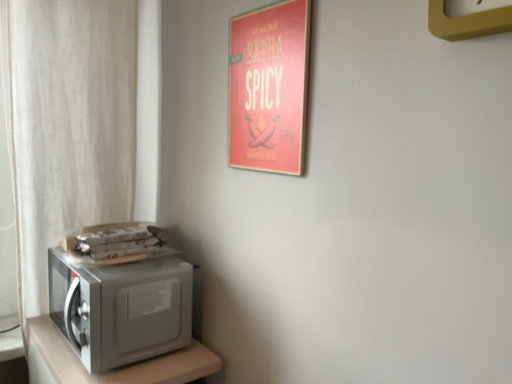
Question: Could you tell me if satin silver microwave at lower left is turned towards yellow plastic clock at upper right?

Choices:
 (A) yes
 (B) no

Answer: (B)

Question: From a real-world perspective, is satin silver microwave at lower left on top of yellow plastic clock at upper right?

Choices:
 (A) yes
 (B) no

Answer: (B)

Question: Can you confirm if satin silver microwave at lower left is positioned to the right of yellow plastic clock at upper right?

Choices:
 (A) no
 (B) yes

Answer: (A)

Question: Considering the relative sizes of satin silver microwave at lower left and yellow plastic clock at upper right in the image provided, is satin silver microwave at lower left wider than yellow plastic clock at upper right?

Choices:
 (A) no
 (B) yes

Answer: (B)

Question: From the image's perspective, is satin silver microwave at lower left beneath yellow plastic clock at upper right?

Choices:
 (A) no
 (B) yes

Answer: (B)

Question: Do you think satin silver microwave at lower left is within white sheer curtain at left, or outside of it?

Choices:
 (A) inside
 (B) outside

Answer: (B)

Question: Considering the positions of satin silver microwave at lower left and white sheer curtain at left in the image, is satin silver microwave at lower left taller or shorter than white sheer curtain at left?

Choices:
 (A) tall
 (B) short

Answer: (B)

Question: Is satin silver microwave at lower left in front of or behind white sheer curtain at left in the image?

Choices:
 (A) front
 (B) behind

Answer: (A)

Question: Is satin silver microwave at lower left wider or thinner than white sheer curtain at left?

Choices:
 (A) wide
 (B) thin

Answer: (A)

Question: Would you say satin silver microwave at left is inside or outside yellow plastic clock at upper right?

Choices:
 (A) inside
 (B) outside

Answer: (B)

Question: In the image, is satin silver microwave at left positioned in front of or behind yellow plastic clock at upper right?

Choices:
 (A) behind
 (B) front

Answer: (A)

Question: From the image's perspective, relative to yellow plastic clock at upper right, is satin silver microwave at left above or below?

Choices:
 (A) above
 (B) below

Answer: (B)

Question: From a real-world perspective, is satin silver microwave at left physically located above or below yellow plastic clock at upper right?

Choices:
 (A) below
 (B) above

Answer: (A)

Question: Is white sheer curtain at left wider or thinner than yellow plastic clock at upper right?

Choices:
 (A) wide
 (B) thin

Answer: (A)

Question: Relative to yellow plastic clock at upper right, is white sheer curtain at left in front or behind?

Choices:
 (A) behind
 (B) front

Answer: (A)